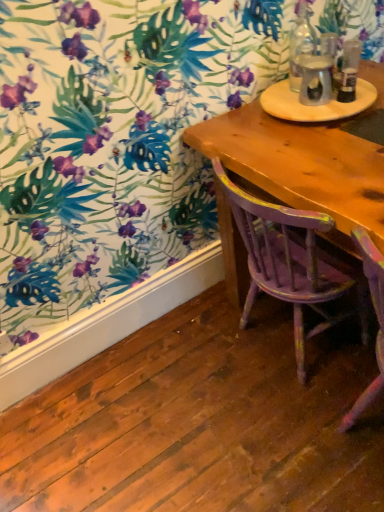
This screenshot has width=384, height=512. What do you see at coordinates (301, 44) in the screenshot?
I see `clear glass bottle at upper right, the 2th bottle from the right` at bounding box center [301, 44].

The width and height of the screenshot is (384, 512). What are the coordinates of `wooden round table at upper right` in the screenshot? It's located at (315, 105).

You are a GUI agent. You are given a task and a screenshot of the screen. Output one action in this format:
    pyautogui.click(x=<x>, y=<y>)
    Task: Click on the round table lying below the translucent glass bottle at upper right (from the image's perspective)
    
    Given the screenshot: What is the action you would take?
    pyautogui.click(x=315, y=105)

From the image's perspective, is translucent glass bottle at upper right on top of wooden round table at upper right?

Yes, from the image's perspective, translucent glass bottle at upper right is above wooden round table at upper right.

Which of these two, translucent glass bottle at upper right or wooden round table at upper right, is wider?

wooden round table at upper right.

Considering the sizes of objects translucent glass bottle at upper right and wooden round table at upper right in the image provided, who is taller, translucent glass bottle at upper right or wooden round table at upper right?

Standing taller between the two is translucent glass bottle at upper right.

Identify the location of chair below the clear glass bottle at upper right, the 1th bottle viewed from the left (from a real-world perspective). (291, 263).

From the image's perspective, which one is positioned lower, clear glass bottle at upper right, the 2th bottle from the right, or distressed purple wood chair at center?

distressed purple wood chair at center.

Is clear glass bottle at upper right, the 2th bottle from the right, with distressed purple wood chair at center?

No, clear glass bottle at upper right, the 2th bottle from the right, is not making contact with distressed purple wood chair at center.

Is clear glass bottle at upper right, the 1th bottle viewed from the left, positioned with its back to distressed purple wood chair at center?

No, clear glass bottle at upper right, the 1th bottle viewed from the left, is not facing away from distressed purple wood chair at center.

Locate an element on the screen. This screenshot has width=384, height=512. chair in front of the wooden round table at upper right is located at coordinates (291, 263).

Is distressed purple wood chair at center positioned far away from wooden round table at upper right?

No.

Which is more to the right, distressed purple wood chair at center or wooden round table at upper right?

wooden round table at upper right.

Considering the relative sizes of distressed purple wood chair at center and wooden round table at upper right in the image provided, is distressed purple wood chair at center bigger than wooden round table at upper right?

Indeed, distressed purple wood chair at center has a larger size compared to wooden round table at upper right.

Image resolution: width=384 pixels, height=512 pixels. Find the location of `beverage located on the right of distressed purple wood chair at center`. beverage located on the right of distressed purple wood chair at center is located at coordinates [x=316, y=80].

Is translucent glass bottle at upper right looking in the opposite direction of distressed purple wood chair at center?

That's not correct — translucent glass bottle at upper right is not looking away from distressed purple wood chair at center.

Is distressed purple wood chair at center inside translucent glass bottle at upper right?

No, distressed purple wood chair at center is not inside translucent glass bottle at upper right.

Considering the sizes of objects translucent glass bottle at upper right and distressed purple wood chair at center in the image provided, who is thinner, translucent glass bottle at upper right or distressed purple wood chair at center?

With smaller width is translucent glass bottle at upper right.

Is wooden round table at upper right to the right of clear glass bottle at upper right, the 1th bottle viewed from the left, from the viewer's perspective?

Yes, wooden round table at upper right is to the right of clear glass bottle at upper right, the 1th bottle viewed from the left.

Is wooden round table at upper right taller than clear glass bottle at upper right, the 1th bottle viewed from the left?

No.

Considering the positions of points (362, 99) and (294, 91), is point (362, 99) farther from camera compared to point (294, 91)?

No, it is not.

From the image's perspective, does wooden round table at upper right appear higher than clear glass bottle at upper right, the 2th bottle from the right?

Incorrect, from the image's perspective, wooden round table at upper right is lower than clear glass bottle at upper right, the 2th bottle from the right.

Are distressed purple wood chair at center and clear glass bottle at upper right, the 2th bottle in the left-to-right sequence, located far from each other?

They are positioned close to each other.

Is distressed purple wood chair at center spatially inside clear glass bottle at upper right, the 2th bottle in the left-to-right sequence, or outside of it?

distressed purple wood chair at center is not inside clear glass bottle at upper right, the 2th bottle in the left-to-right sequence, it's outside.

Is distressed purple wood chair at center oriented away from clear glass bottle at upper right, which ranks as the 1th bottle in right-to-left order?

distressed purple wood chair at center is not turned away from clear glass bottle at upper right, which ranks as the 1th bottle in right-to-left order.

Considering their positions, is clear glass bottle at upper right, the 2th bottle in the left-to-right sequence, located in front of or behind distressed purple wood chair at center?

clear glass bottle at upper right, the 2th bottle in the left-to-right sequence, is behind distressed purple wood chair at center.

Between clear glass bottle at upper right, the 2th bottle in the left-to-right sequence, and distressed purple wood chair at center, which one has smaller size?

clear glass bottle at upper right, the 2th bottle in the left-to-right sequence, is smaller.

Which of these two, clear glass bottle at upper right, which ranks as the 1th bottle in right-to-left order, or distressed purple wood chair at center, stands taller?

distressed purple wood chair at center is taller.

From the image's perspective, starting from the distressed purple wood chair at center, which bottle is the 1st one above? Please provide its 2D coordinates.

[(349, 70)]

Find the location of a particular element. Image resolution: width=384 pixels, height=512 pixels. beverage located above the wooden round table at upper right (from the image's perspective) is located at coordinates (316, 80).

I want to click on chair below the clear glass bottle at upper right, the 2th bottle from the right (from a real-world perspective), so click(x=291, y=263).

When comparing their distances from translucent glass bottle at upper right, does wooden round table at upper right or clear glass bottle at upper right, the 2th bottle in the left-to-right sequence, seem further?

clear glass bottle at upper right, the 2th bottle in the left-to-right sequence, is further to translucent glass bottle at upper right.

Based on their spatial positions, is clear glass bottle at upper right, which ranks as the 1th bottle in right-to-left order, or wooden round table at upper right further from translucent glass bottle at upper right?

The object further to translucent glass bottle at upper right is clear glass bottle at upper right, which ranks as the 1th bottle in right-to-left order.

Based on their spatial positions, is distressed purple wood chair at center or translucent glass bottle at upper right closer to clear glass bottle at upper right, which ranks as the 1th bottle in right-to-left order?

translucent glass bottle at upper right.

Based on their spatial positions, is translucent glass bottle at upper right or clear glass bottle at upper right, the 1th bottle viewed from the left, further from clear glass bottle at upper right, which ranks as the 1th bottle in right-to-left order?

clear glass bottle at upper right, the 1th bottle viewed from the left, lies further to clear glass bottle at upper right, which ranks as the 1th bottle in right-to-left order, than the other object.

Based on their spatial positions, is wooden round table at upper right or distressed purple wood chair at center closer to clear glass bottle at upper right, the 1th bottle viewed from the left?

Based on the image, wooden round table at upper right appears to be nearer to clear glass bottle at upper right, the 1th bottle viewed from the left.

Considering their positions, is translucent glass bottle at upper right positioned closer to clear glass bottle at upper right, the 1th bottle viewed from the left, than wooden round table at upper right?

The object closer to clear glass bottle at upper right, the 1th bottle viewed from the left, is translucent glass bottle at upper right.

Looking at the image, which one is located closer to distressed purple wood chair at center, wooden round table at upper right or clear glass bottle at upper right, the 1th bottle viewed from the left?

Among the two, wooden round table at upper right is located nearer to distressed purple wood chair at center.

Estimate the real-world distances between objects in this image. Which object is further from wooden round table at upper right, translucent glass bottle at upper right or distressed purple wood chair at center?

The object further to wooden round table at upper right is distressed purple wood chair at center.

At what (x,y) coordinates should I click in order to perform the action: click on round table between clear glass bottle at upper right, which ranks as the 1th bottle in right-to-left order, and distressed purple wood chair at center, in the vertical direction. Please return your answer as a coordinate pair (x, y). This screenshot has height=512, width=384. Looking at the image, I should click on (315, 105).

At what (x,y) coordinates should I click in order to perform the action: click on bottle that lies between clear glass bottle at upper right, the 2th bottle from the right, and wooden round table at upper right from top to bottom. Please return your answer as a coordinate pair (x, y). Image resolution: width=384 pixels, height=512 pixels. Looking at the image, I should click on (349, 70).

At what (x,y) coordinates should I click in order to perform the action: click on beverage between clear glass bottle at upper right, which ranks as the 1th bottle in right-to-left order, and distressed purple wood chair at center, in the vertical direction. Please return your answer as a coordinate pair (x, y). Looking at the image, I should click on (316, 80).

You are a GUI agent. You are given a task and a screenshot of the screen. Output one action in this format:
    pyautogui.click(x=<x>, y=<y>)
    Task: Click on the beverage between clear glass bottle at upper right, the 1th bottle viewed from the left, and distressed purple wood chair at center, in the vertical direction
    The height and width of the screenshot is (512, 384).
    Given the screenshot: What is the action you would take?
    pyautogui.click(x=316, y=80)